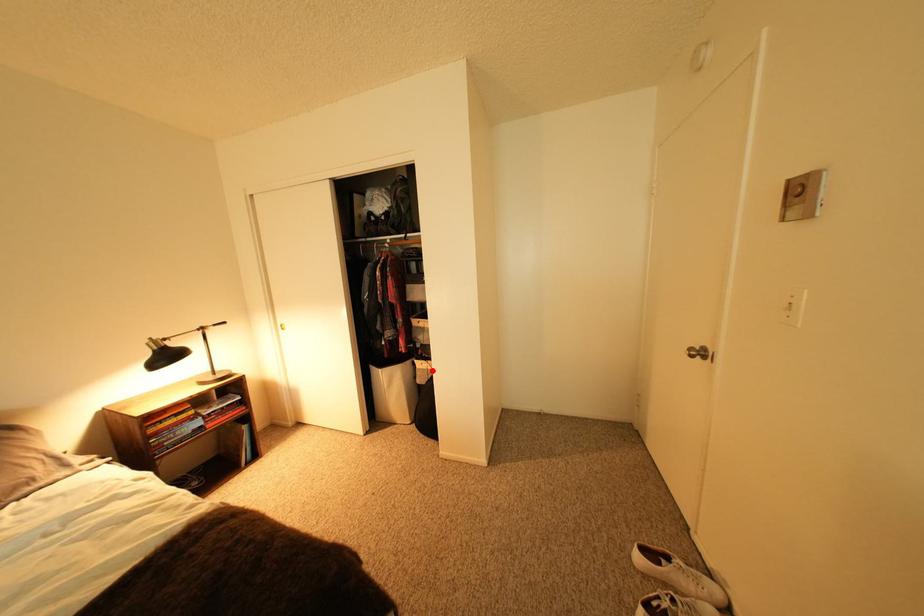
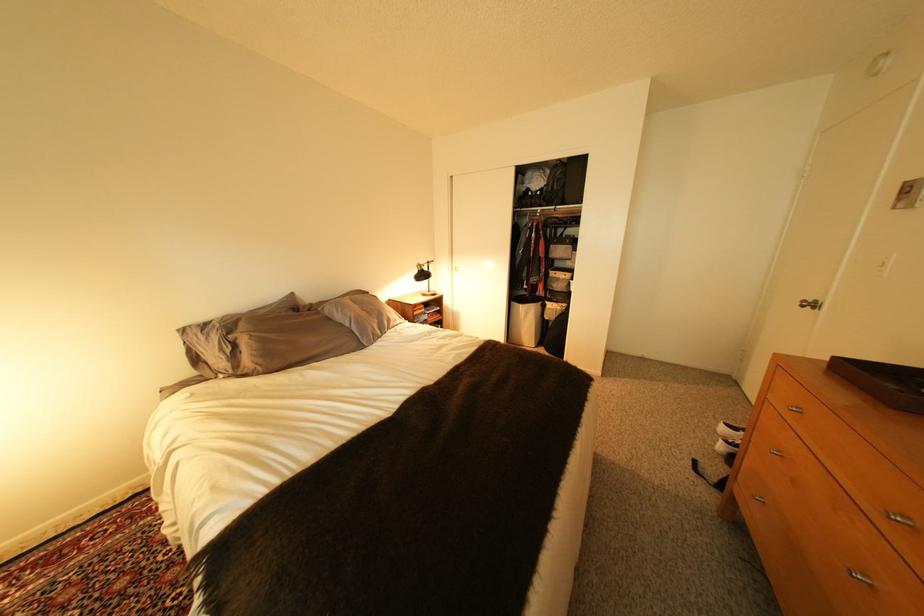
Question: I am providing you with two images of the same scene from different viewpoints. Given a red point in image1, look at the same physical point in image2. Is it:

Choices:
 (A) Closer to the viewpoint
 (B) Farther from the viewpoint

Answer: (A)